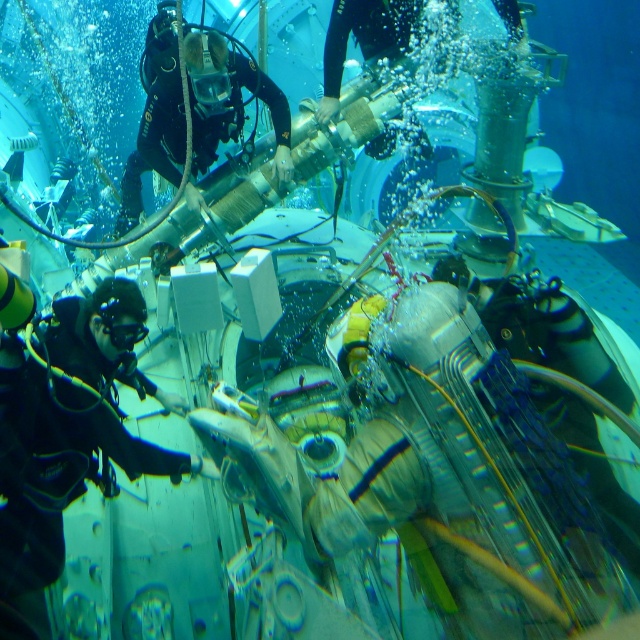
From the picture: You are a marine biologist observing the underwater scene. You notice the black rubber diving suit at left and the black matte goggles at center. Which object is positioned closer to your viewpoint?

The black rubber diving suit at left is closer to the viewer than the black matte goggles at center.

You are a marine biologist observing the underwater scene. You notice the black rubber diver at upper left and the black matte goggles at center. Which object is taller in the image?

The black rubber diver at upper left is taller than the black matte goggles at center.

You are an underwater construction supervisor observing the scene. You notice two black rubber diving suits in the image. Which one, the black rubber diving suit at left or the black rubber diver at upper left, is shorter in height?

The black rubber diving suit at left has a lesser height compared to the black rubber diver at upper left, so the black rubber diving suit at left is shorter.